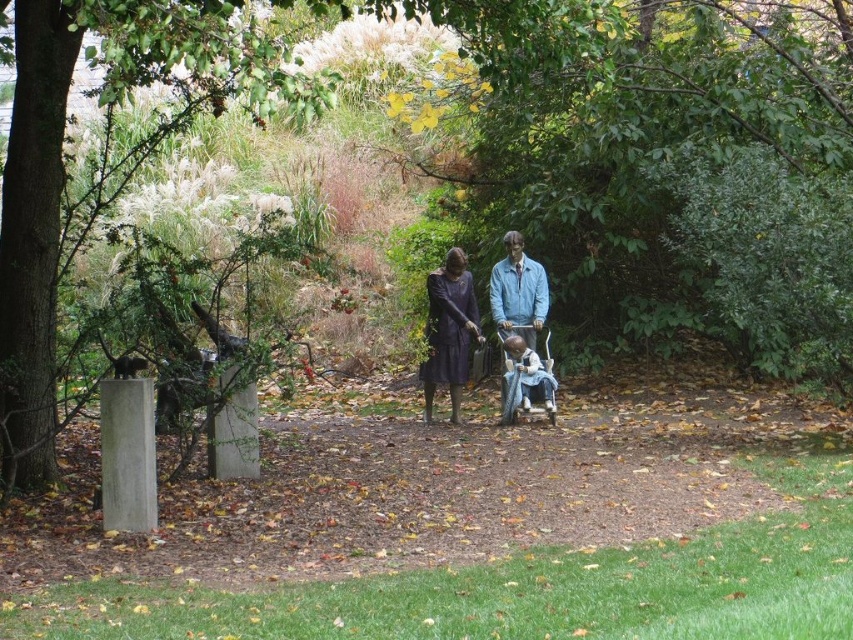
Who is positioned more to the left, green leafy tree at center or blue painted wood man at center?

Positioned to the left is blue painted wood man at center.

Does green leafy tree at center have a greater width compared to blue painted wood man at center?

Yes, green leafy tree at center is wider than blue painted wood man at center.

Between point (694, 280) and point (527, 262), which one is positioned in front?

Point (527, 262) is in front.

Find the location of a particular element. This screenshot has width=853, height=640. green leafy tree at center is located at coordinates (666, 161).

This screenshot has width=853, height=640. What do you see at coordinates (448, 328) in the screenshot? I see `matte black dress at center` at bounding box center [448, 328].

What do you see at coordinates (448, 328) in the screenshot?
I see `matte black dress at center` at bounding box center [448, 328].

Image resolution: width=853 pixels, height=640 pixels. I want to click on matte black dress at center, so click(448, 328).

Does matte purple dress at center have a lesser height compared to wooden baby carriage at center?

Incorrect, matte purple dress at center's height does not fall short of wooden baby carriage at center's.

Is point (447, 252) positioned before point (531, 397)?

No, (447, 252) is behind (531, 397).

The image size is (853, 640). Find the location of `matte purple dress at center`. matte purple dress at center is located at coordinates (450, 330).